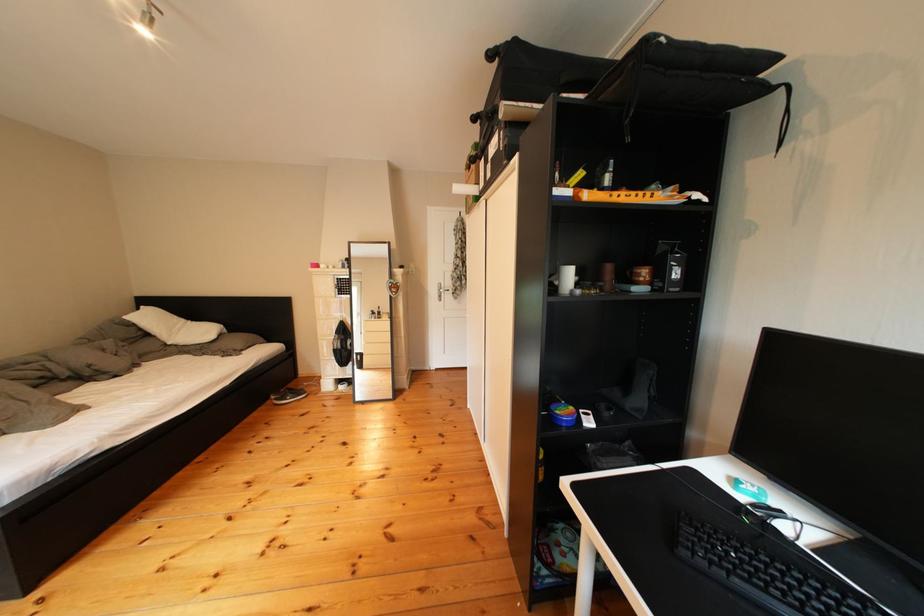
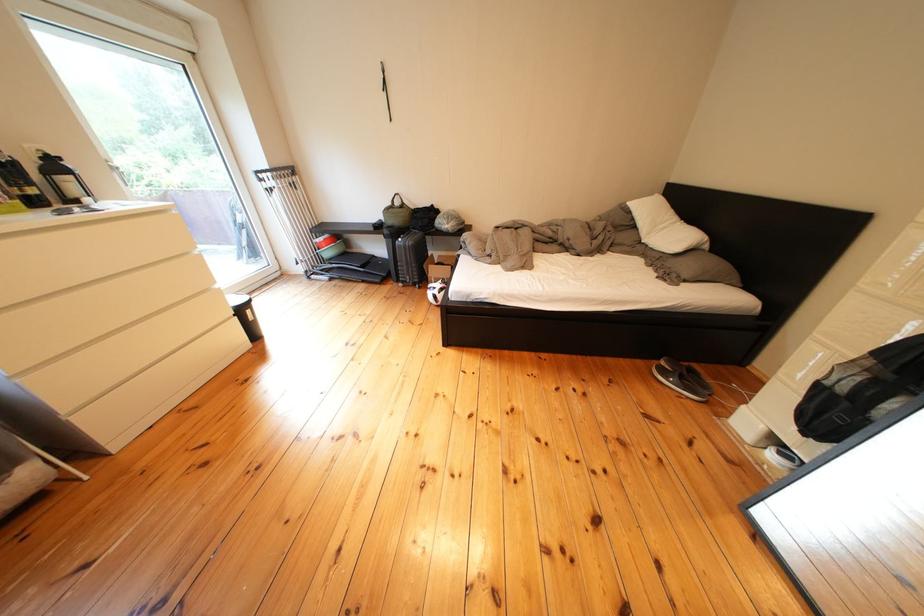
In the second image, find the point that corresponds to the point at 161,339 in the first image.

(649, 230)